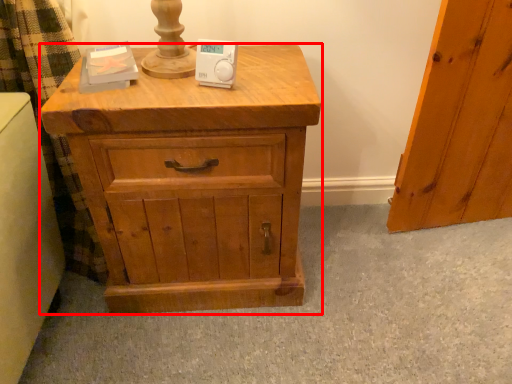
Question: In this image, where is chest of drawers (annotated by the red box) located relative to ipod?

Choices:
 (A) left
 (B) right

Answer: (A)